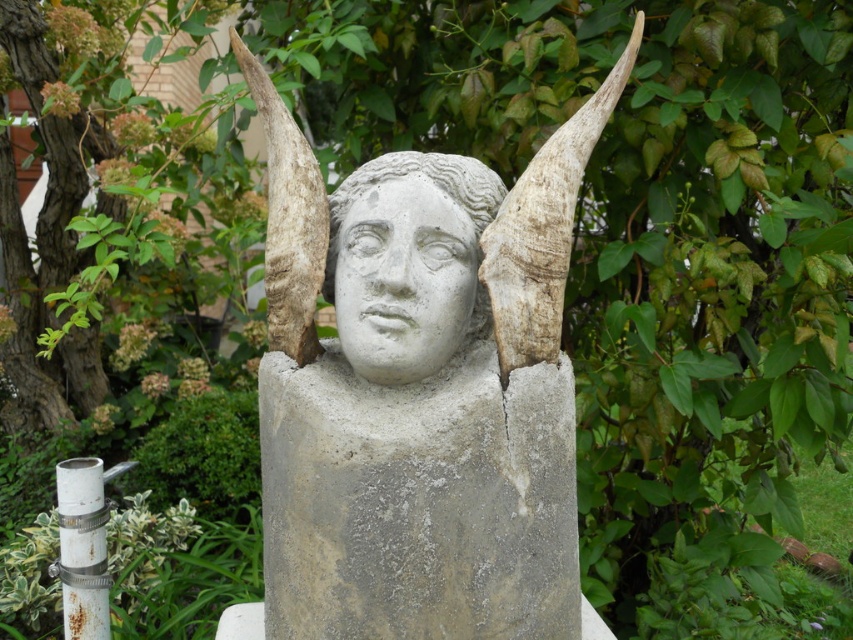
Question: Which of these objects is positioned closest to the gray stone statue at center?

Choices:
 (A) gray concrete statue at center
 (B) white stone head at center

Answer: (A)

Question: Can you confirm if gray stone statue at center is bigger than white stone head at center?

Choices:
 (A) yes
 (B) no

Answer: (A)

Question: Is gray stone statue at center bigger than white stone head at center?

Choices:
 (A) no
 (B) yes

Answer: (B)

Question: Which object is positioned closest to the gray stone statue at center?

Choices:
 (A) white stone head at center
 (B) gray concrete statue at center

Answer: (B)

Question: Is gray concrete statue at center wider than white stone head at center?

Choices:
 (A) no
 (B) yes

Answer: (B)

Question: Which point is closer to the camera?

Choices:
 (A) pyautogui.click(x=439, y=509)
 (B) pyautogui.click(x=296, y=256)

Answer: (A)